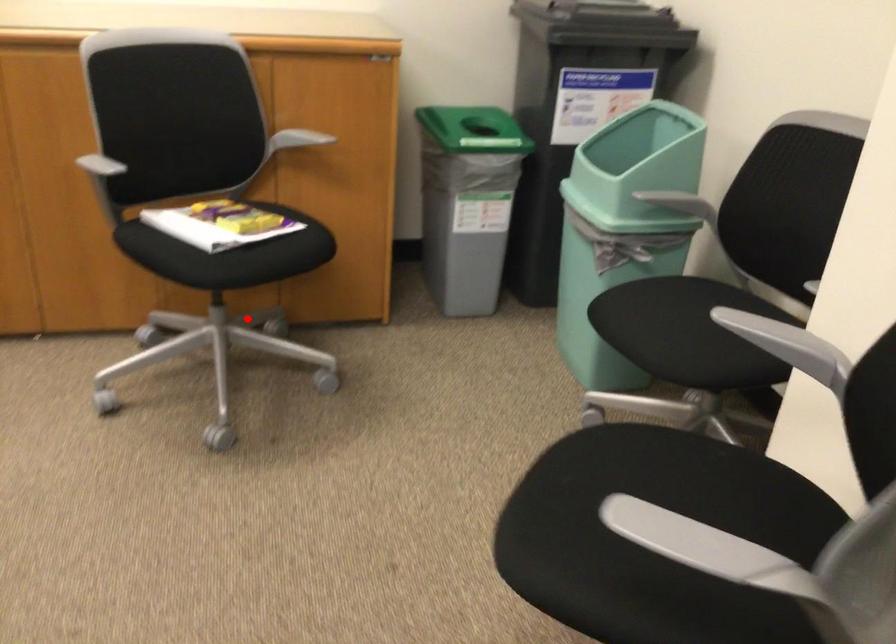
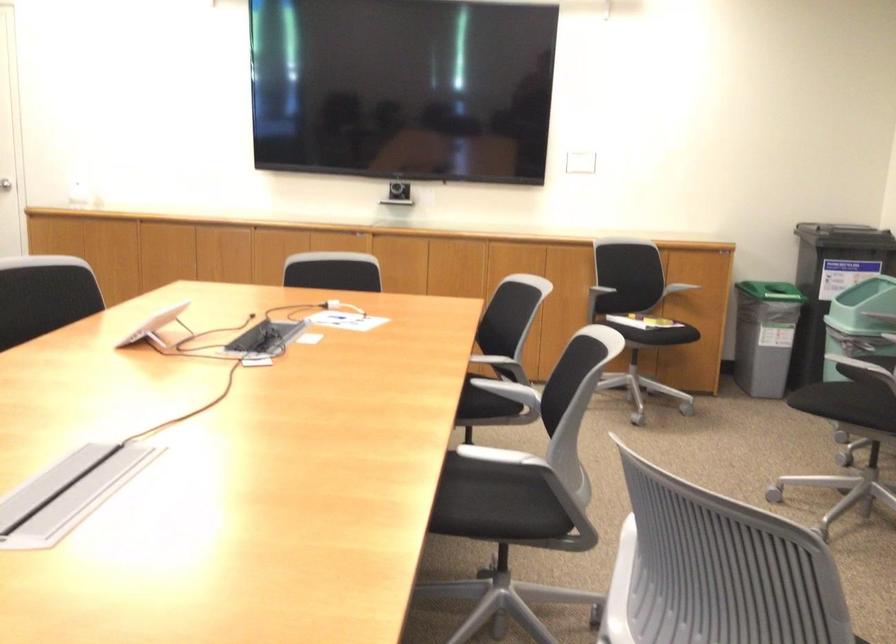
The point at the highlighted location is marked in the first image. Where is the corresponding point in the second image?

(647, 353)